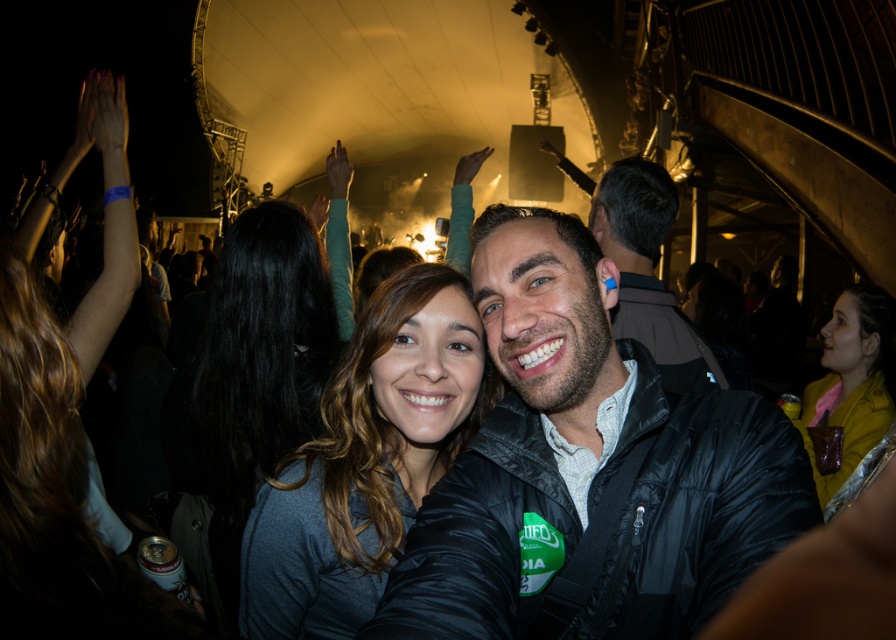
You are standing in the concert venue and want to take a photo of the black leather jacket at center. Where should you aim your camera to capture it?

You should aim your camera at the coordinates point (589, 472) to capture the black leather jacket at center.

You are at a concert venue with a curved ceiling. You see two jackets at the center of the image, a dark blue jacket at center and a yellow leather jacket at center. Which one is taller?

The dark blue jacket at center is much taller than the yellow leather jacket at center.